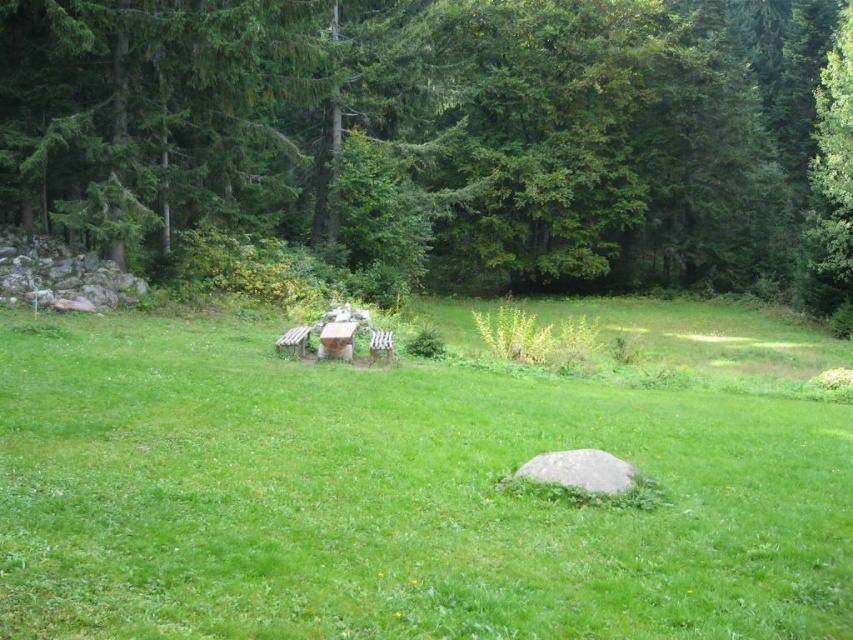
Question: Among these points, which one is nearest to the camera?

Choices:
 (A) (341, 115)
 (B) (407, 492)

Answer: (B)

Question: Is green grassy field at center further to the viewer compared to green leafy tree at upper center?

Choices:
 (A) yes
 (B) no

Answer: (B)

Question: Does green grassy field at center have a lesser width compared to green leafy tree at upper center?

Choices:
 (A) no
 (B) yes

Answer: (B)

Question: Is green grassy field at center further to the viewer compared to green leafy tree at upper center?

Choices:
 (A) yes
 (B) no

Answer: (B)

Question: Among these objects, which one is farthest from the camera?

Choices:
 (A) green leafy tree at upper center
 (B) green grassy field at center

Answer: (A)